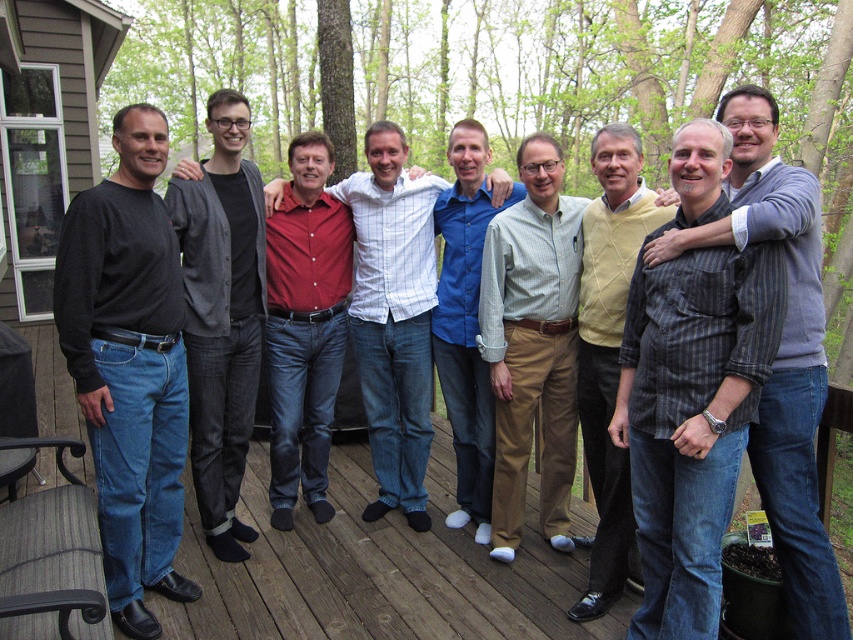
Based on the photo, you are a photographer trying to capture a candid shot of the black cotton shirt at left and the red shirt at center. Since you want to ensure both subjects are in focus, you need to know their vertical positions. Can you tell me which one is lower in the frame?

The black cotton shirt at left is positioned under the red shirt at center, so the black cotton shirt at left is lower in the frame.

You are standing in front of a group of men on a wooden deck surrounded by trees. You see the red shirt at center and the blue cotton shirt at center. Which shirt is closer to you?

The red shirt at center is closer to you because it is further to the viewer than the blue cotton shirt at center.

Looking at the group of men on the wooden deck, where is the black cotton shirt at left in relation to the blue cotton shirt at center?

The black cotton shirt at left is positioned to the left of the blue cotton shirt at center.